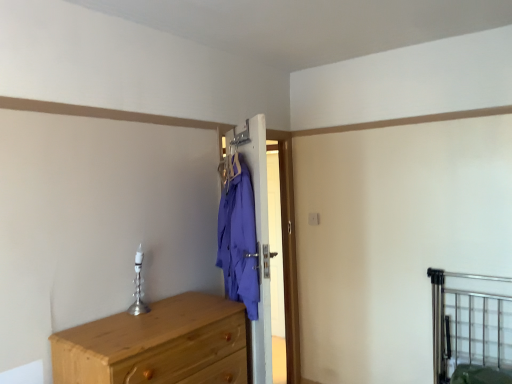
This screenshot has width=512, height=384. What do you see at coordinates (471, 327) in the screenshot?
I see `metallic silver bed frame at lower right` at bounding box center [471, 327].

In order to click on metallic silver bed frame at lower right in this screenshot , I will do `click(471, 327)`.

The image size is (512, 384). What do you see at coordinates (151, 342) in the screenshot?
I see `light brown wooden chest of drawers at lower left` at bounding box center [151, 342].

The width and height of the screenshot is (512, 384). I want to click on light brown wooden chest of drawers at lower left, so click(151, 342).

At what (x,y) coordinates should I click in order to perform the action: click on metallic silver bed frame at lower right. Please return your answer as a coordinate pair (x, y). Looking at the image, I should click on (x=471, y=327).

Looking at this image, is light brown wooden chest of drawers at lower left to the left or to the right of metallic silver bed frame at lower right in the image?

From the image, it's evident that light brown wooden chest of drawers at lower left is to the left of metallic silver bed frame at lower right.

Is light brown wooden chest of drawers at lower left in front of metallic silver bed frame at lower right?

Yes, light brown wooden chest of drawers at lower left is closer to the camera.

Which is in front, point (176, 381) or point (492, 332)?

The point (176, 381) is closer.

From the image's perspective, is light brown wooden chest of drawers at lower left under metallic silver bed frame at lower right?

Incorrect, from the image's perspective, light brown wooden chest of drawers at lower left is higher than metallic silver bed frame at lower right.

From a real-world perspective, is light brown wooden chest of drawers at lower left positioned above or below metallic silver bed frame at lower right?

light brown wooden chest of drawers at lower left is above metallic silver bed frame at lower right.

Looking at their sizes, would you say light brown wooden chest of drawers at lower left is wider or thinner than metallic silver bed frame at lower right?

In the image, light brown wooden chest of drawers at lower left appears to be wider than metallic silver bed frame at lower right.

Does light brown wooden chest of drawers at lower left have a lesser height compared to metallic silver bed frame at lower right?

Yes.

From the picture: In terms of size, does light brown wooden chest of drawers at lower left appear bigger or smaller than metallic silver bed frame at lower right?

light brown wooden chest of drawers at lower left is bigger than metallic silver bed frame at lower right.

Is light brown wooden chest of drawers at lower left surrounding metallic silver bed frame at lower right?

Actually, metallic silver bed frame at lower right is outside light brown wooden chest of drawers at lower left.

Is light brown wooden chest of drawers at lower left not near metallic silver bed frame at lower right?

Indeed, light brown wooden chest of drawers at lower left is not near metallic silver bed frame at lower right.

Could you tell me if light brown wooden chest of drawers at lower left is turned towards metallic silver bed frame at lower right?

No, light brown wooden chest of drawers at lower left is not facing towards metallic silver bed frame at lower right.

How distant is light brown wooden chest of drawers at lower left from metallic silver bed frame at lower right?

light brown wooden chest of drawers at lower left and metallic silver bed frame at lower right are 1.59 meters apart from each other.

Where is `the chest of drawers in front of the metallic silver bed frame at lower right`? The width and height of the screenshot is (512, 384). the chest of drawers in front of the metallic silver bed frame at lower right is located at coordinates (151, 342).

From the picture: Which object is positioned more to the left, metallic silver bed frame at lower right or light brown wooden chest of drawers at lower left?

From the viewer's perspective, light brown wooden chest of drawers at lower left appears more on the left side.

Which object is further away from the camera taking this photo, metallic silver bed frame at lower right or light brown wooden chest of drawers at lower left?

metallic silver bed frame at lower right is more distant.

Between point (437, 273) and point (219, 320), which one is positioned in front?

The point (219, 320) is in front.

From the image's perspective, which one is positioned higher, metallic silver bed frame at lower right or light brown wooden chest of drawers at lower left?

light brown wooden chest of drawers at lower left, from the image's perspective.

From a real-world perspective, who is located higher, metallic silver bed frame at lower right or light brown wooden chest of drawers at lower left?

From a 3D spatial view, light brown wooden chest of drawers at lower left is above.

Is metallic silver bed frame at lower right wider or thinner than light brown wooden chest of drawers at lower left?

metallic silver bed frame at lower right is thinner than light brown wooden chest of drawers at lower left.

Does metallic silver bed frame at lower right have a lesser height compared to light brown wooden chest of drawers at lower left?

No, metallic silver bed frame at lower right is not shorter than light brown wooden chest of drawers at lower left.

Who is bigger, metallic silver bed frame at lower right or light brown wooden chest of drawers at lower left?

Bigger between the two is light brown wooden chest of drawers at lower left.

Would you say light brown wooden chest of drawers at lower left is part of metallic silver bed frame at lower right's contents?

A: Actually, light brown wooden chest of drawers at lower left is outside metallic silver bed frame at lower right.

Is metallic silver bed frame at lower right directly adjacent to light brown wooden chest of drawers at lower left?

metallic silver bed frame at lower right is not next to light brown wooden chest of drawers at lower left, and they're not touching.

Could you tell me if metallic silver bed frame at lower right is facing light brown wooden chest of drawers at lower left?

No, metallic silver bed frame at lower right is not oriented towards light brown wooden chest of drawers at lower left.

Can you tell me how much metallic silver bed frame at lower right and light brown wooden chest of drawers at lower left differ in facing direction?

The angular difference between metallic silver bed frame at lower right and light brown wooden chest of drawers at lower left is 88.9 degrees.

How far apart are metallic silver bed frame at lower right and light brown wooden chest of drawers at lower left?

A distance of 5.21 feet exists between metallic silver bed frame at lower right and light brown wooden chest of drawers at lower left.

Find the location of a particular element. This screenshot has height=384, width=512. the chest of drawers that is above the metallic silver bed frame at lower right (from the image's perspective) is located at coordinates (151, 342).

This screenshot has width=512, height=384. Identify the location of chest of drawers located on the left of metallic silver bed frame at lower right. (151, 342).

The width and height of the screenshot is (512, 384). Identify the location of bed frame below the light brown wooden chest of drawers at lower left (from the image's perspective). tap(471, 327).